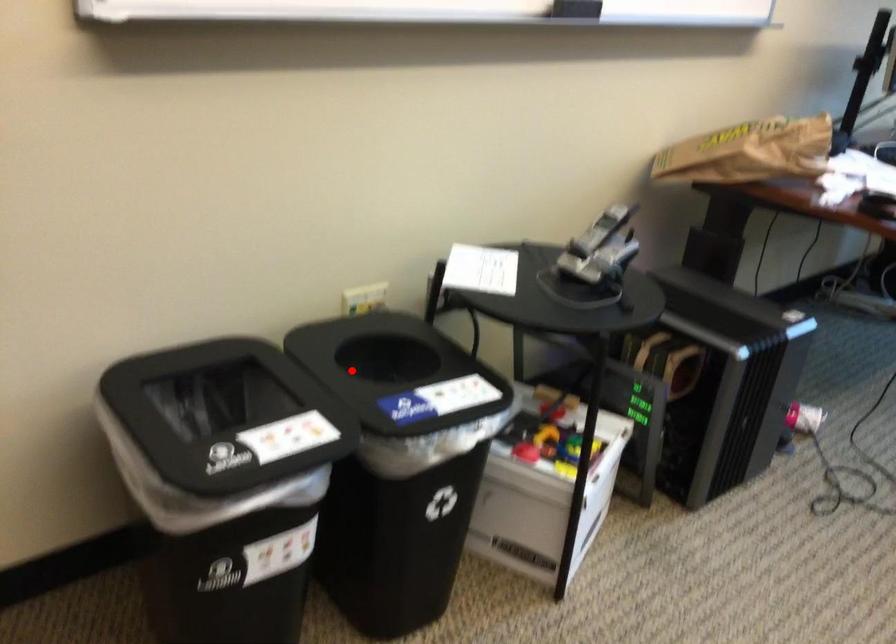
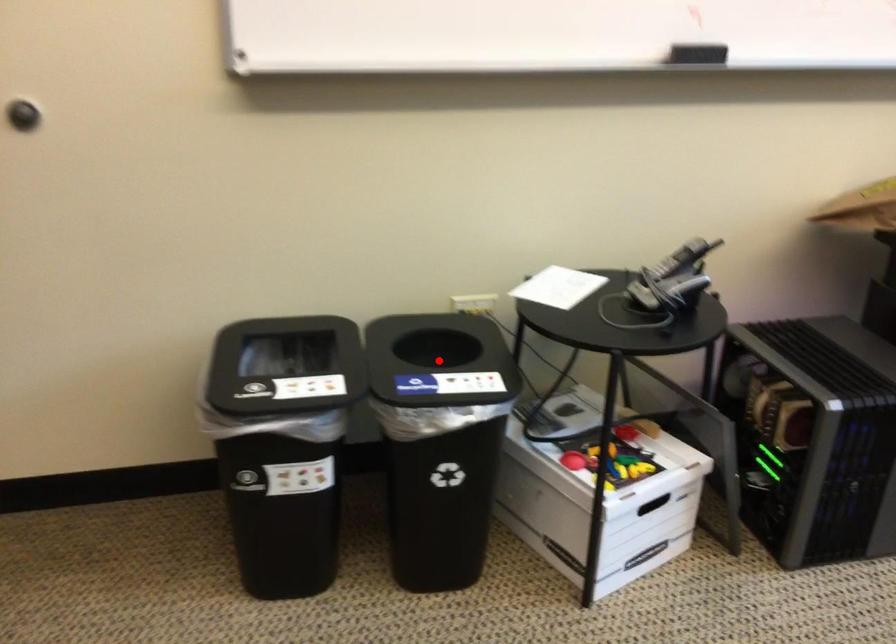
I am providing you with two images of the same scene from different viewpoints. A red point is marked on the first image and another point is marked on the second image. Is the marked point in image1 the same physical position as the marked point in image2?

Yes